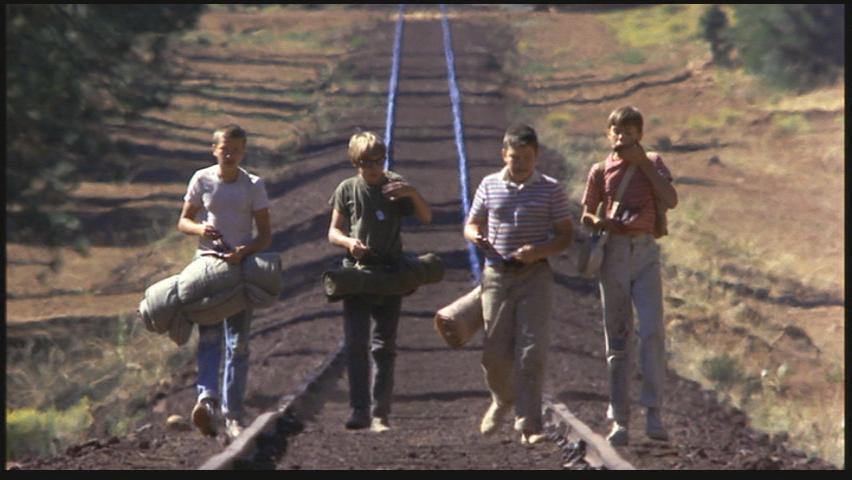
Locate an element on the screen. The width and height of the screenshot is (852, 480). bedrolls is located at coordinates (406, 279), (209, 291).